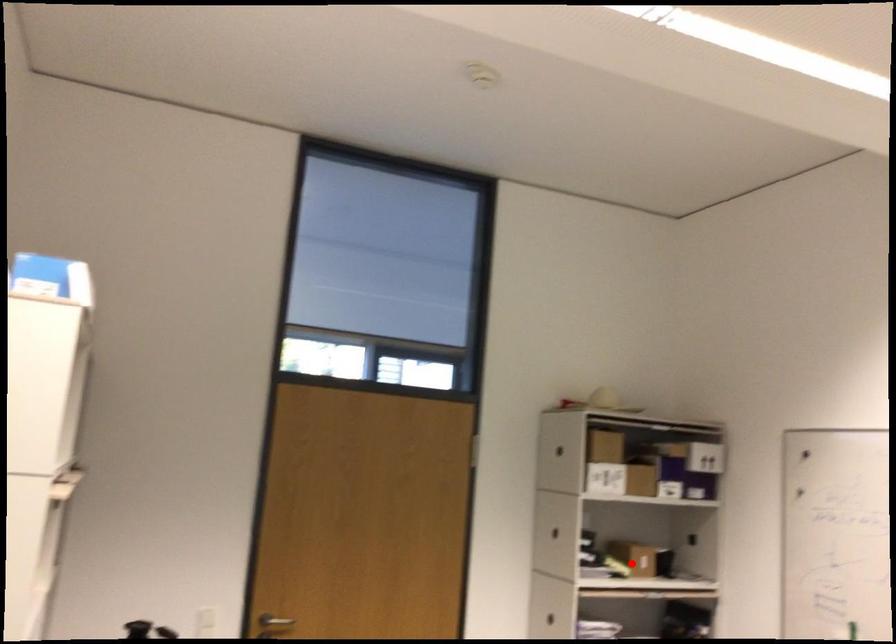
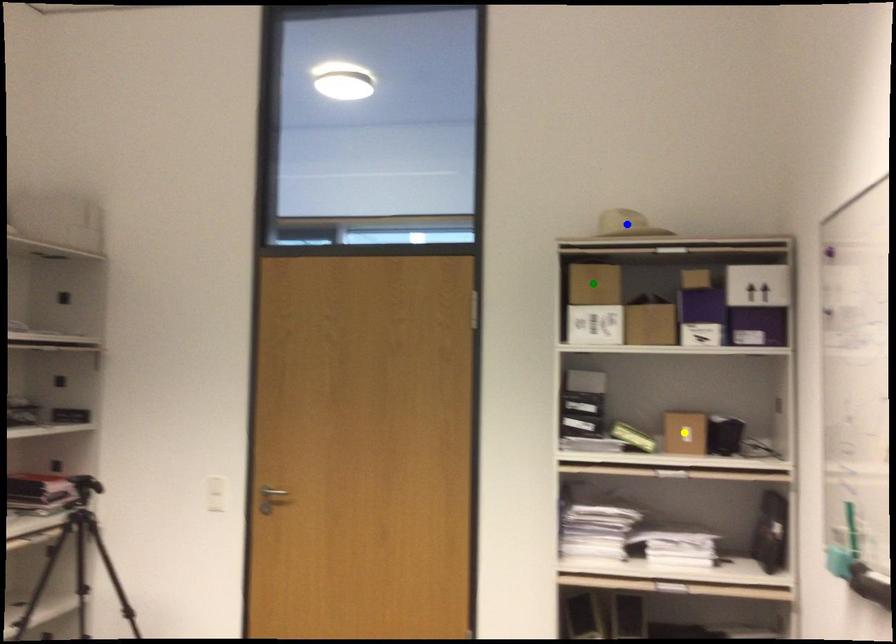
Question: I am providing you with two images of the same scene from different viewpoints. A red point is marked on the first image. You are given multiple points on the second image. Which spot in image 2 lines up with the point in image 1?

Choices:
 (A) blue point
 (B) yellow point
 (C) green point

Answer: (B)